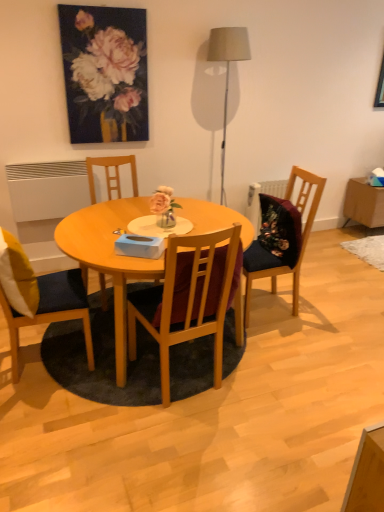
Question: Is dark blue fabric chair at center, acting as the first chair starting from the right, in front of or behind yellow fabric pillow at left in the image?

Choices:
 (A) front
 (B) behind

Answer: (B)

Question: In terms of size, does dark blue fabric chair at center, acting as the first chair starting from the right, appear bigger or smaller than yellow fabric pillow at left?

Choices:
 (A) small
 (B) big

Answer: (B)

Question: Estimate the real-world distances between objects in this image. Which object is farther from the wooden chair at left, positioned as the 4th chair in right-to-left order?

Choices:
 (A) matte gray floor lamp at upper center
 (B) white matte radiator at lower left
 (C) yellow fabric pillow at left
 (D) wooden chair at center, which appears as the third chair when viewed from the right
 (E) wooden chair at center, the 2th chair when ordered from right to left

Answer: (A)

Question: Which of these objects is positioned closest to the wooden side table at right?

Choices:
 (A) wooden chair at center, which appears as the third chair when viewed from the right
 (B) dark blue fabric chair at center, the fourth chair viewed from the left
 (C) wooden chair at center, which appears as the third chair when viewed from the left
 (D) matte gray floor lamp at upper center
 (E) light brown wooden table at center

Answer: (B)